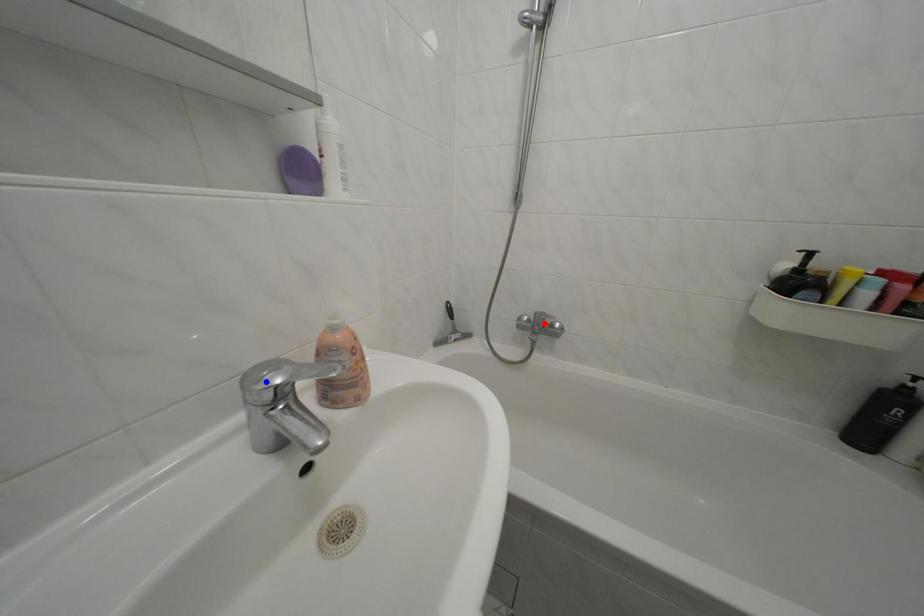
Question: Which of the two points in the image is closer to the camera?

Choices:
 (A) Blue point is closer.
 (B) Red point is closer.

Answer: (A)